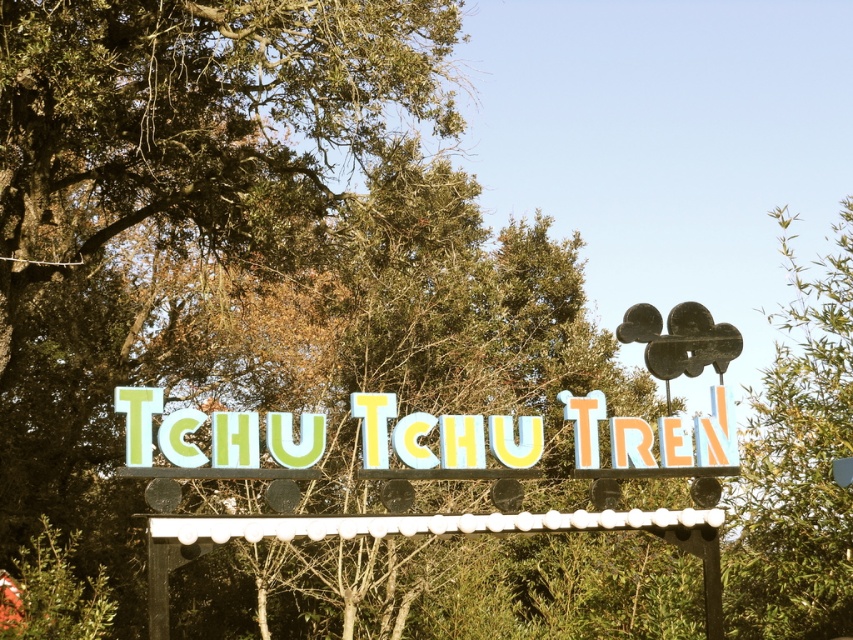
You are standing in front of the TCHU TCHU TREIN signboard. There is a point marked at coordinates (798, 461) on the signboard. What object is located at this point?

The point at coordinates (798, 461) marks the green leafy tree at upper right.

You are standing in front of the signboard with the text TCHU TCHU TREIN. There are two points marked on the signboard at coordinates point (845, 417) and point (664, 476). Which point is closer to you?

Point (664, 476) is closer to you because it is less further to the camera than point (845, 417).

You are standing in front of the signboard and want to touch both the green leafy tree at upper right and the pastel painted letters at center. Which object will you reach first?

You will reach the green leafy tree at upper right first because it is closer to you than the pastel painted letters at center.